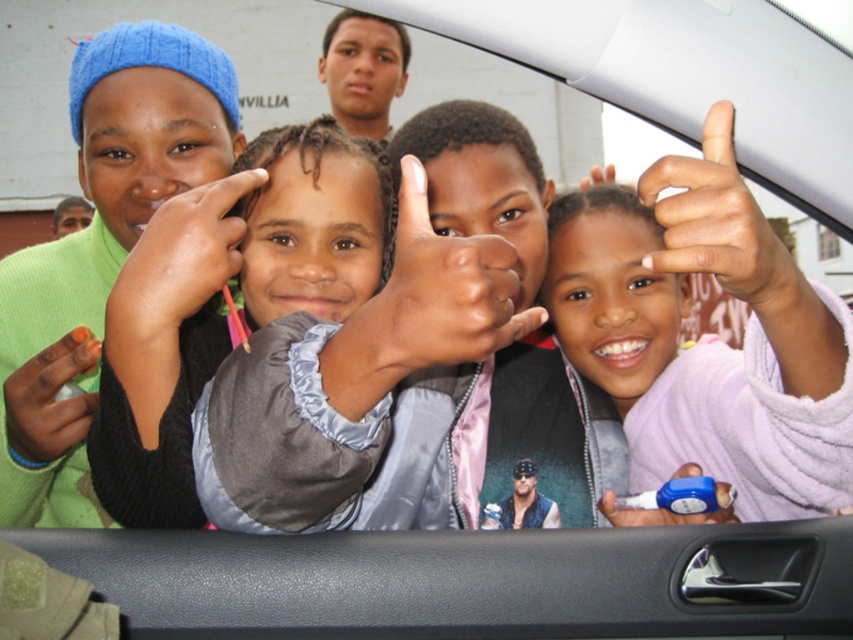
The image size is (853, 640). I want to click on blue knit cap at upper left, so click(100, 248).

Is white matte nail at upper center wider than orange matte nail polish at lower left?

Correct, the width of white matte nail at upper center exceeds that of orange matte nail polish at lower left.

Is point (677, 234) positioned behind point (56, 384)?

No.

I want to click on white matte nail at upper center, so click(x=718, y=224).

Measure the distance between point (155, 58) and camera.

The distance of point (155, 58) from camera is 2.95 meters.

Is blue knit cap at upper left to the left of smooth skin face at upper center from the viewer's perspective?

Yes, blue knit cap at upper left is to the left of smooth skin face at upper center.

Where is `blue knit cap at upper left`? The width and height of the screenshot is (853, 640). blue knit cap at upper left is located at coordinates (100, 248).